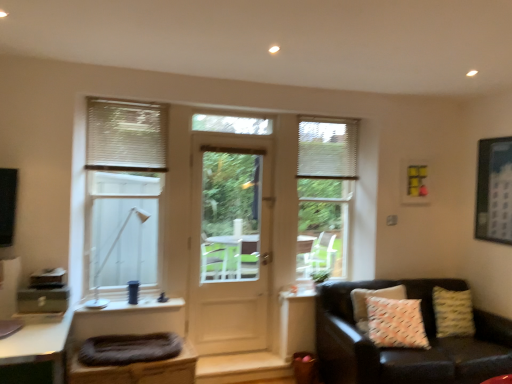
Question: Considering the positions of white textured pillow at right and yellow matte picture frame at upper right, the second picture frame in the front-to-back sequence, in the image, is white textured pillow at right wider or thinner than yellow matte picture frame at upper right, the second picture frame in the front-to-back sequence,?

Choices:
 (A) wide
 (B) thin

Answer: (A)

Question: Is point (421, 337) closer or farther from the camera than point (415, 192)?

Choices:
 (A) farther
 (B) closer

Answer: (B)

Question: Which object is positioned farthest from the yellow matte picture frame at upper right, the second picture frame in the front-to-back sequence?

Choices:
 (A) dark gray fabric footrest at lower left
 (B) white textured pillow at right
 (C) white glossy desk at lower left
 (D) white textured blinds at upper right, acting as the first shutter starting from the back
 (E) metallic silver picture frame at upper right, which is counted as the 2th picture frame, starting from the left

Answer: (C)

Question: Based on their relative distances, which object is nearer to the white glossy desk at lower left?

Choices:
 (A) white textured blinds at upper right, marked as the 1th shutter in a right-to-left arrangement
 (B) white textured pillow at right
 (C) dark gray fabric footrest at lower left
 (D) leather couch with patterned pillows at lower right
 (E) white blinds at center, which ranks as the 1th window in right-to-left order

Answer: (C)